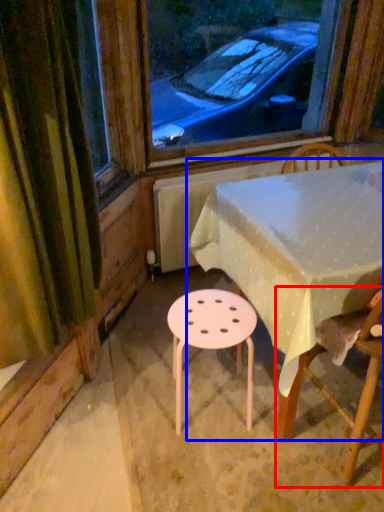
Question: Which point is further to the camera, chair (highlighted by a red box) or table (highlighted by a blue box)?

Choices:
 (A) chair
 (B) table

Answer: (B)